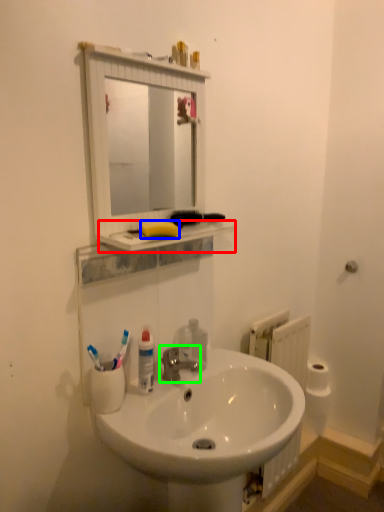
Question: Considering the real-world distances, which object is farthest from counter top (highlighted by a red box)? soap (highlighted by a blue box) or tap (highlighted by a green box)?

Choices:
 (A) soap
 (B) tap

Answer: (B)